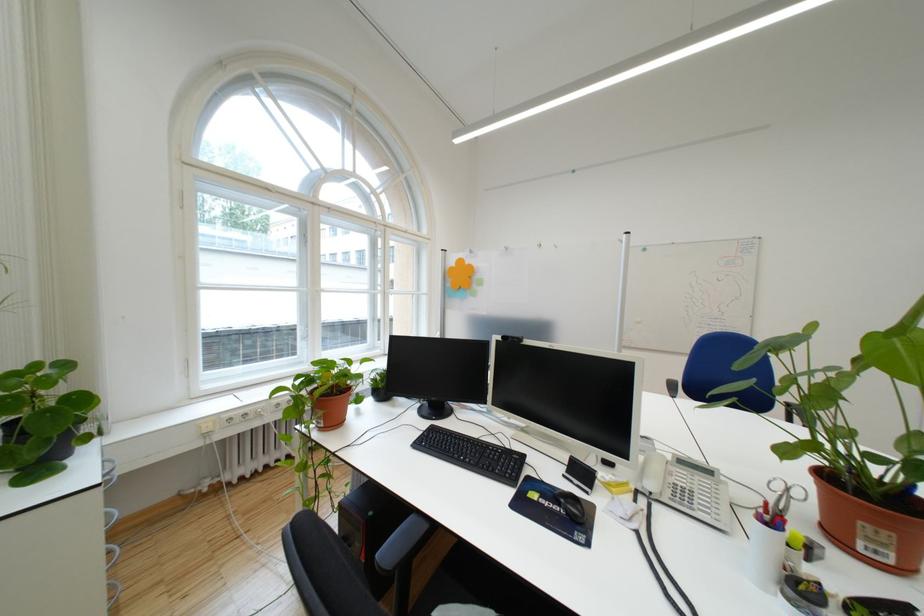
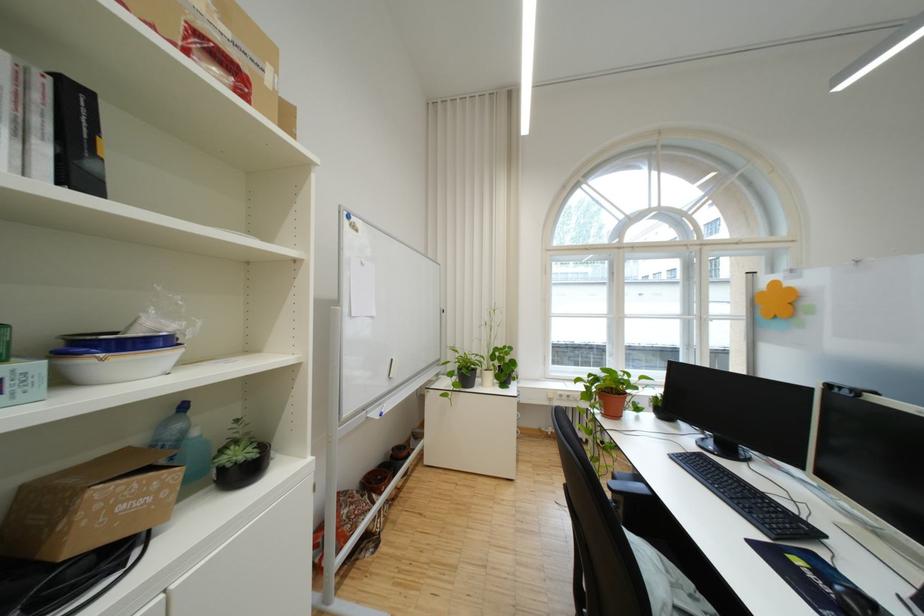
In the second image, find the point that corresponds to (464,264) in the first image.

(774, 288)